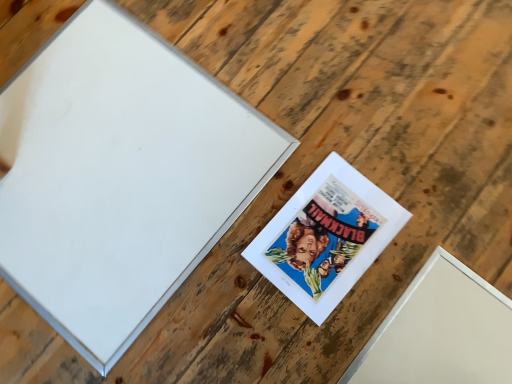
Locate an element on the screen. The image size is (512, 384). vacant space underneath matte paper picture frame at center, placed as the 2th picture frame when sorted from left to right (from a real-world perspective) is located at coordinates (326, 239).